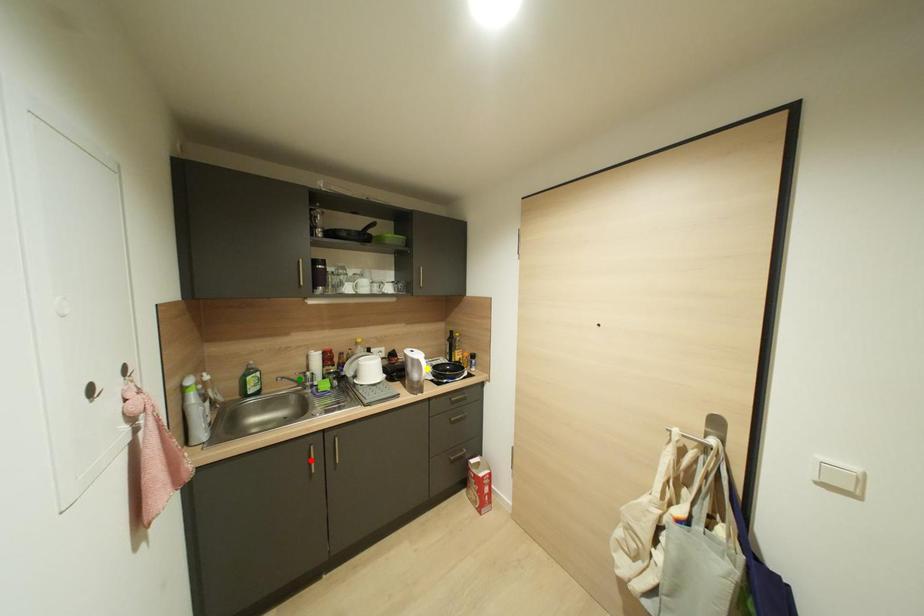
Order these from nearest to farthest:
- green point
- red point
- yellow point

red point
green point
yellow point